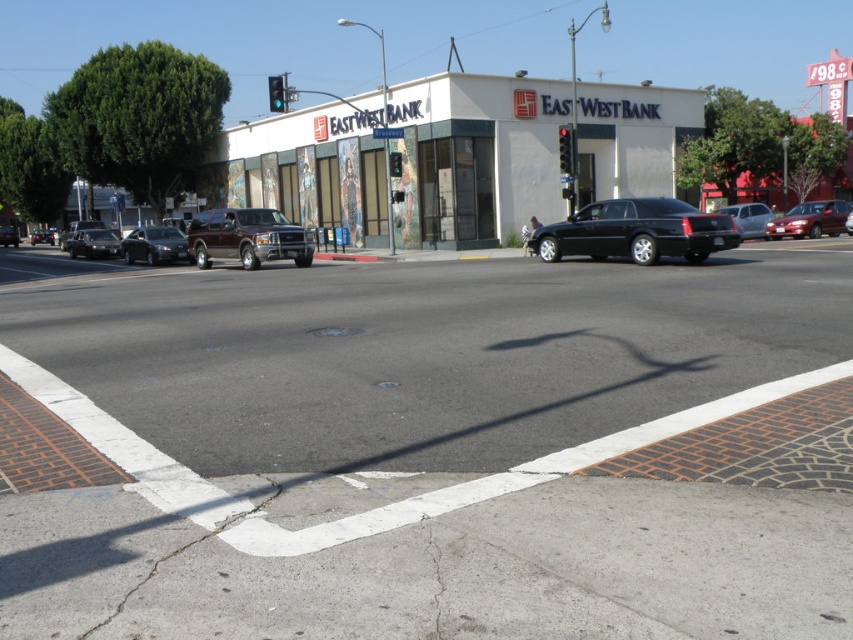
Question: Which object appears farthest from the camera in this image?

Choices:
 (A) white matte east west bank building at center
 (B) metallic silver sedan at center
 (C) green glass traffic light at upper center
 (D) matte black suv at center

Answer: (D)

Question: Among these objects, which one is nearest to the camera?

Choices:
 (A) metallic traffic light at center
 (B) silver metallic sedan at right

Answer: (B)

Question: Observing the image, what is the correct spatial positioning of maroon matte truck at center in reference to matte black suv at center?

Choices:
 (A) right
 (B) left

Answer: (A)

Question: Where is maroon matte truck at center located in relation to green glass traffic light at center in the image?

Choices:
 (A) above
 (B) below

Answer: (B)

Question: Which of the following is the closest to the observer?

Choices:
 (A) silver metallic sedan at right
 (B) green glass traffic light at upper center

Answer: (A)

Question: Can you confirm if shiny red sedan at center is wider than metallic traffic light at center?

Choices:
 (A) yes
 (B) no

Answer: (A)